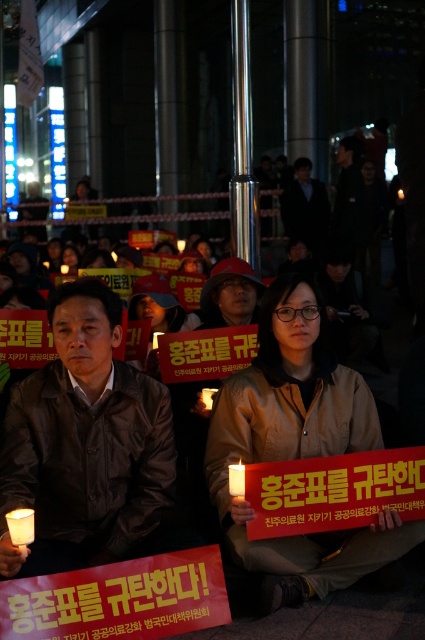
You are a photographer trying to capture a photo of both the brown leather jacket at center and the brown matte jacket at center in the same frame. Based on their sizes, which jacket should you focus on to ensure both fit in the frame without cropping?

The brown leather jacket at center has a lesser width compared to the brown matte jacket at center, so focusing on the brown matte jacket at center would allow both jackets to fit in the frame without cropping since it is wider and can serve as the main focus point.

You are a photographer taking a picture of the protest scene. You notice two points in the image at coordinates point [337,403] and point [232,493]. Which point is closer to your camera lens?

Point [232,493] is closer to the camera lens because it is less further away than point [337,403].